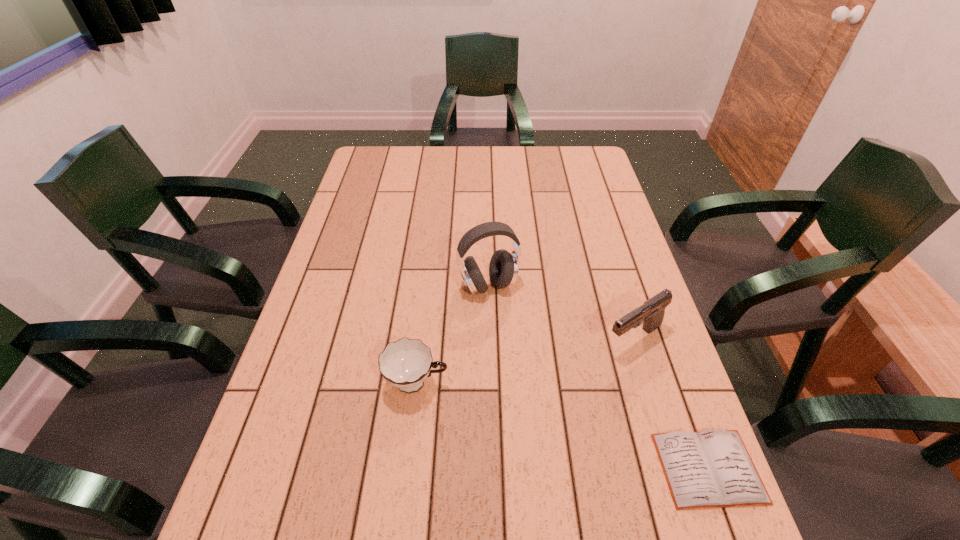
The width and height of the screenshot is (960, 540). What are the coordinates of `free space on the desktop that is between the leftmost object and the nearest object and is positioned on the ear cups of the tallest object` in the screenshot? It's located at (532, 417).

Locate an element on the screen. vacant space on the desktop that is between the leftmost object and the shortest object and is positioned aim along the barrel of the third shortest object is located at coordinates (524, 414).